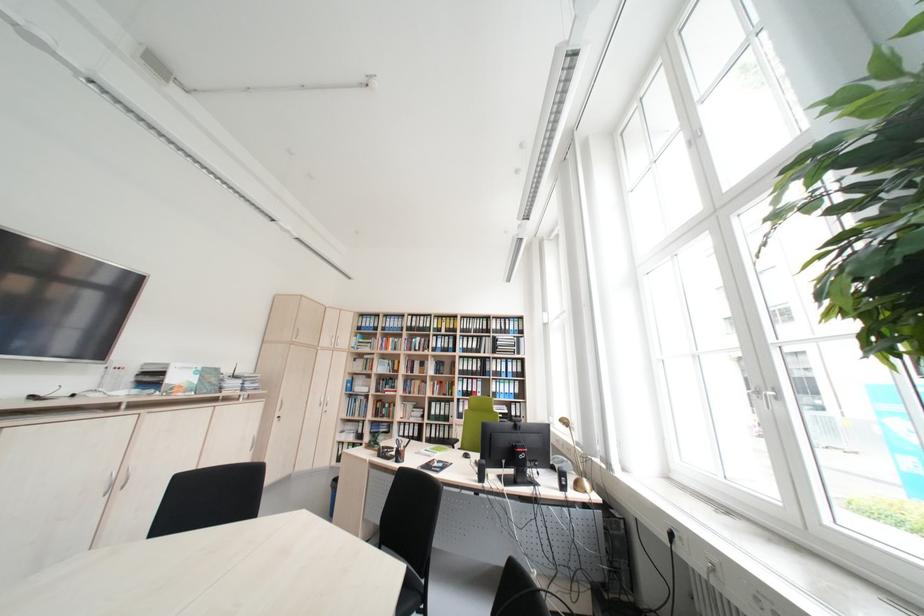
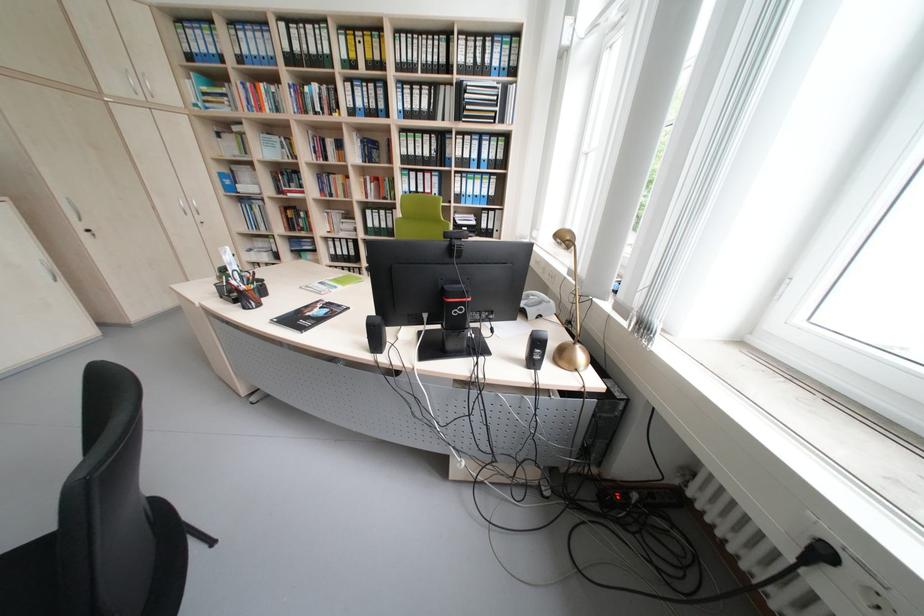
Locate, in the second image, the point that corresponds to point (682, 536) in the first image.

(833, 554)